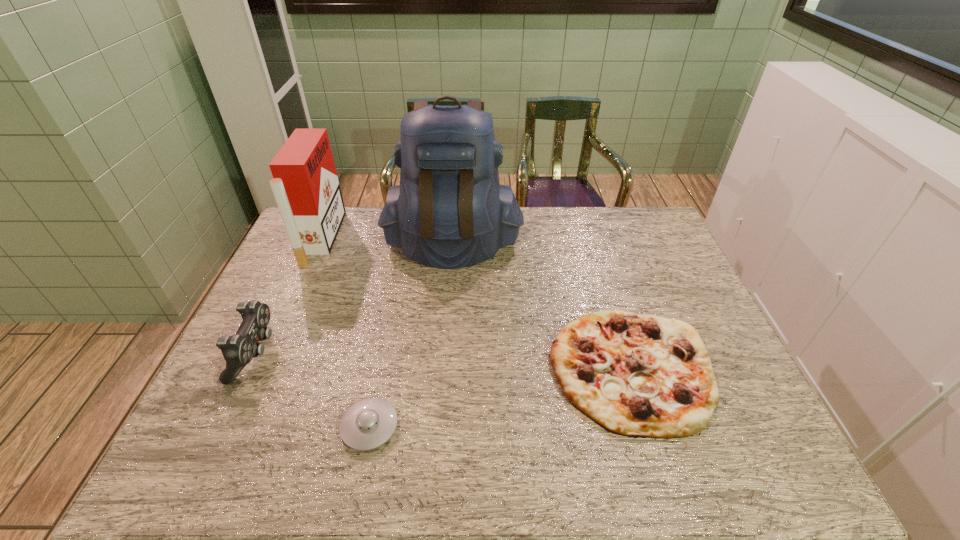
Where is `vacant area that satisfies the following two spatial constraints: 1. on the front-facing side of the cigarette case; 2. on the right side of the saucer`? The height and width of the screenshot is (540, 960). vacant area that satisfies the following two spatial constraints: 1. on the front-facing side of the cigarette case; 2. on the right side of the saucer is located at coordinates (239, 427).

Find the location of a particular element. free location that satisfies the following two spatial constraints: 1. on the back side of the shortest object; 2. on the front-facing side of the second tallest object is located at coordinates (408, 238).

At what (x,y) coordinates should I click in order to perform the action: click on vacant region that satisfies the following two spatial constraints: 1. on the surface of the third shortest object with buttons; 2. on the left side of the shortest object. Please return your answer as a coordinate pair (x, y). Looking at the image, I should click on (221, 427).

The width and height of the screenshot is (960, 540). I want to click on vacant space that satisfies the following two spatial constraints: 1. on the front-facing side of the cigarette case; 2. on the left side of the rightmost object, so (x=265, y=368).

Where is `vacant region that satisfies the following two spatial constraints: 1. on the front-facing side of the saucer; 2. on the right side of the cigarette case`? The image size is (960, 540). vacant region that satisfies the following two spatial constraints: 1. on the front-facing side of the saucer; 2. on the right side of the cigarette case is located at coordinates (239, 427).

The height and width of the screenshot is (540, 960). In order to click on free location that satisfies the following two spatial constraints: 1. at the front pocket of the pizza; 2. on the right side of the tallest object in this screenshot , I will do `click(443, 368)`.